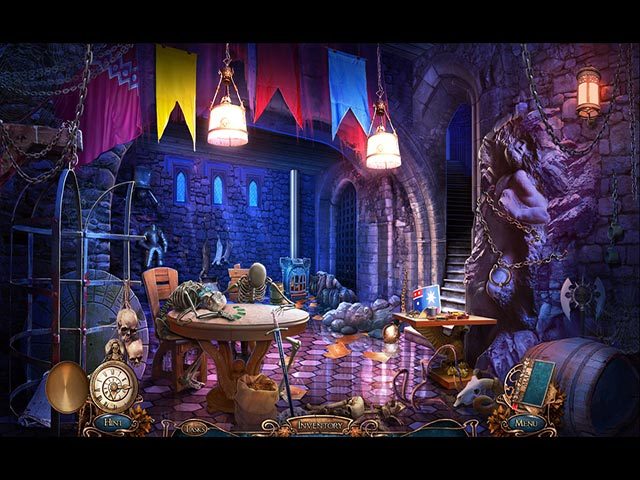
The image size is (640, 480). Find the location of `tables`. tables is located at coordinates (258, 334), (470, 321).